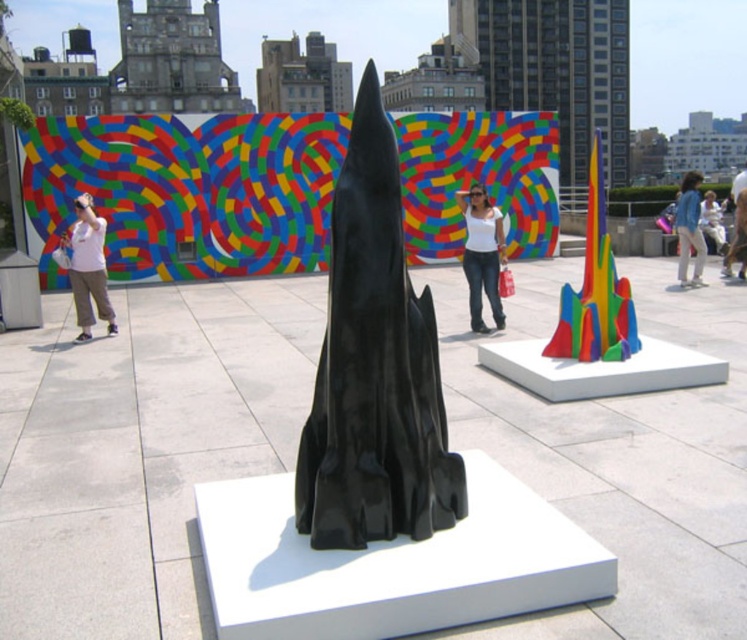
Question: Can you confirm if multicolored plastic cone at right is positioned below white matte shirt at center?

Choices:
 (A) yes
 (B) no

Answer: (B)

Question: Is glossy black rocket at center thinner than matte white shirt at left?

Choices:
 (A) yes
 (B) no

Answer: (B)

Question: Does white matte shirt at center lie in front of matte white shirt at left?

Choices:
 (A) no
 (B) yes

Answer: (B)

Question: Which point is farther to the camera?

Choices:
 (A) (685, 220)
 (B) (350, 490)
 (C) (86, 225)
 (D) (595, 212)

Answer: (A)

Question: Which object is closer to the camera taking this photo?

Choices:
 (A) glossy black rocket at center
 (B) blue denim jacket at upper right

Answer: (A)

Question: Which of the following is the farthest from the observer?

Choices:
 (A) (78, 294)
 (B) (328, 481)

Answer: (A)